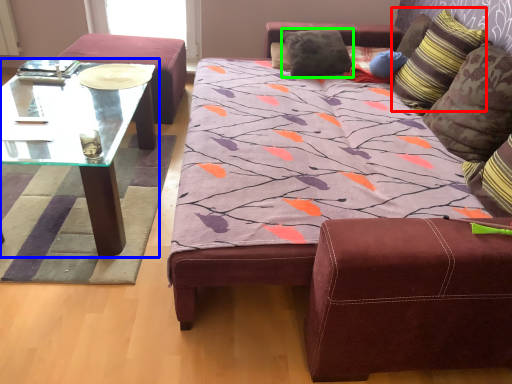
Question: Estimate the real-world distances between objects in this image. Which object is closer to pillow (highlighted by a red box), coffee table (highlighted by a blue box) or pillow (highlighted by a green box)?

Choices:
 (A) coffee table
 (B) pillow

Answer: (B)